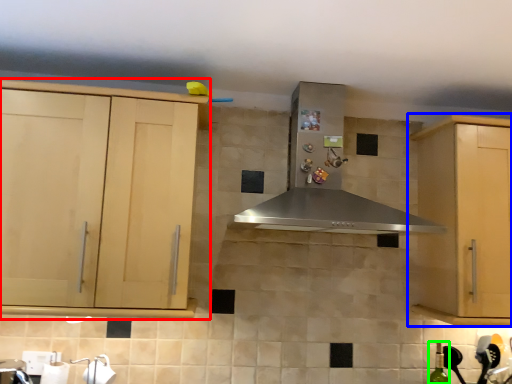
Question: Which is farther away from cabinetry (highlighted by a red box)? cabinetry (highlighted by a blue box) or bottle (highlighted by a green box)?

Choices:
 (A) cabinetry
 (B) bottle

Answer: (B)